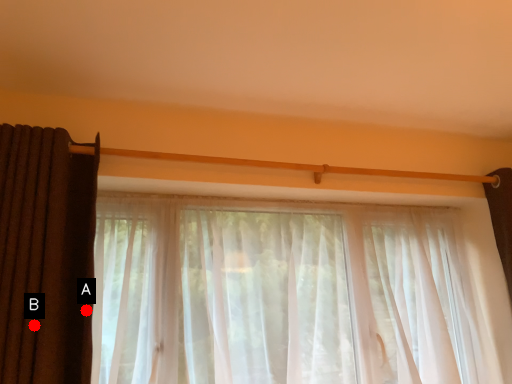
Question: Two points are circled on the image, labeled by A and B beside each circle. Which point is further to the camera?

Choices:
 (A) A is further
 (B) B is further

Answer: (A)